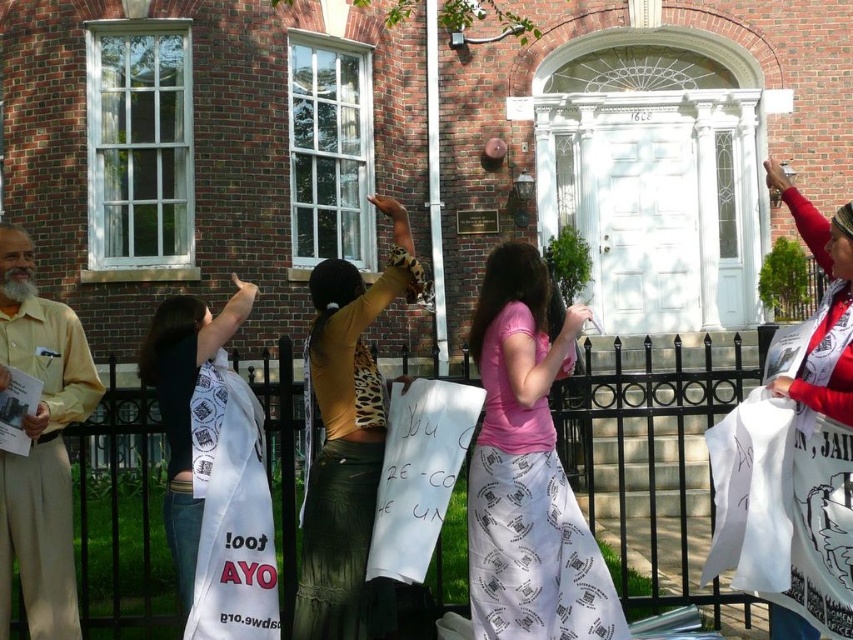
Question: Is black metal fence at center above white fabric banner at center?

Choices:
 (A) no
 (B) yes

Answer: (A)

Question: Among these objects, which one is farthest from the camera?

Choices:
 (A) beige cotton pants at left
 (B) pink fabric skirt at center
 (C) white paper sign at upper right

Answer: (B)

Question: Estimate the real-world distances between objects in this image. Which object is closer to the black metal fence at center?

Choices:
 (A) leopard print blouse at center
 (B) pink fabric skirt at center
 (C) beige cotton pants at left
 (D) white paper sign at upper right

Answer: (C)

Question: Can you confirm if black metal fence at center is thinner than pink fabric skirt at center?

Choices:
 (A) no
 (B) yes

Answer: (A)

Question: Does beige cotton pants at left have a larger size compared to white paper sign at upper right?

Choices:
 (A) no
 (B) yes

Answer: (A)

Question: Which object is closer to the camera taking this photo?

Choices:
 (A) leopard print blouse at center
 (B) black metal fence at center
 (C) white fabric banner at center
 (D) pink fabric skirt at center

Answer: (B)